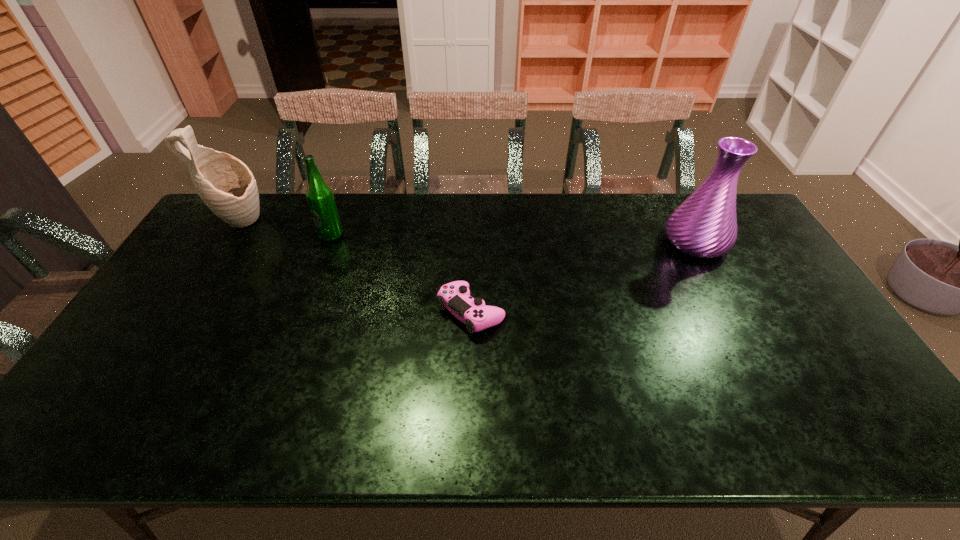
Locate an element on the screen. Image resolution: width=960 pixels, height=540 pixels. vacant area in the image that satisfies the following two spatial constraints: 1. on the label of the control; 2. on the left side of the second shortest object is located at coordinates (303, 312).

Locate an element on the screen. Image resolution: width=960 pixels, height=540 pixels. vacant space that satisfies the following two spatial constraints: 1. on the label of the vase; 2. on the right side of the beer bottle is located at coordinates click(329, 242).

The width and height of the screenshot is (960, 540). I want to click on free spot that satisfies the following two spatial constraints: 1. at the spout of the pitcher; 2. on the right side of the shortest object, so click(x=184, y=312).

What are the coordinates of `vacant region that satisfies the following two spatial constraints: 1. on the back side of the vase; 2. at the spout of the pitcher` in the screenshot? It's located at (685, 222).